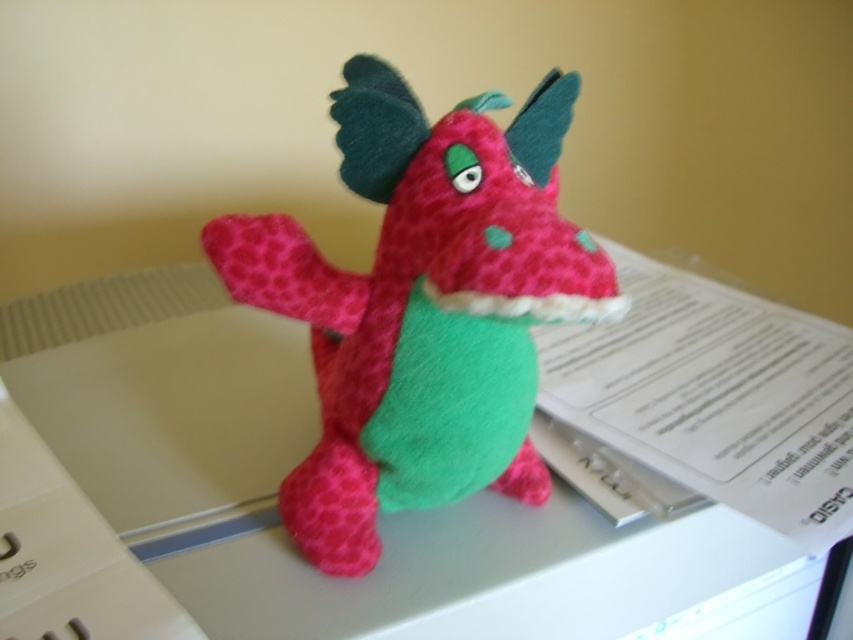
Does felt table at center have a smaller size compared to matte pink plush dragon at center?

Actually, felt table at center might be larger than matte pink plush dragon at center.

Who is higher up, felt table at center or matte pink plush dragon at center?

matte pink plush dragon at center is above.

Which is in front, point (570, 627) or point (485, 260)?

Point (485, 260) is more forward.

The height and width of the screenshot is (640, 853). In order to click on felt table at center in this screenshot , I will do `click(393, 515)`.